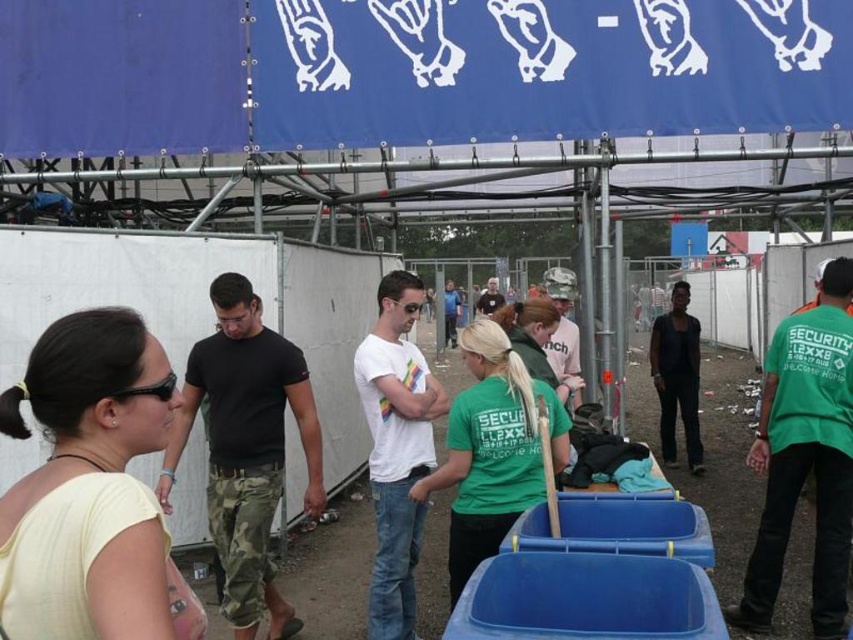
Question: Is yellow matte shirt at lower left behind black matte shirt at center?

Choices:
 (A) no
 (B) yes

Answer: (A)

Question: Which object appears farthest from the camera in this image?

Choices:
 (A) green cotton shirt at center
 (B) blue fabric canopy at upper center
 (C) green cotton t-shirt at center
 (D) black matte t-shirt at center

Answer: (B)

Question: Is blue fabric canopy at upper center thinner than white cotton t-shirt at center?

Choices:
 (A) yes
 (B) no

Answer: (B)

Question: Which object appears closest to the camera in this image?

Choices:
 (A) blue fabric canopy at upper center
 (B) black matte t-shirt at center

Answer: (B)

Question: Considering the relative positions of black matte t-shirt at center and white cotton t-shirt at center in the image provided, where is black matte t-shirt at center located with respect to white cotton t-shirt at center?

Choices:
 (A) above
 (B) below

Answer: (B)

Question: Which point appears farthest from the camera in this image?

Choices:
 (A) (369, 376)
 (B) (564, 408)

Answer: (B)